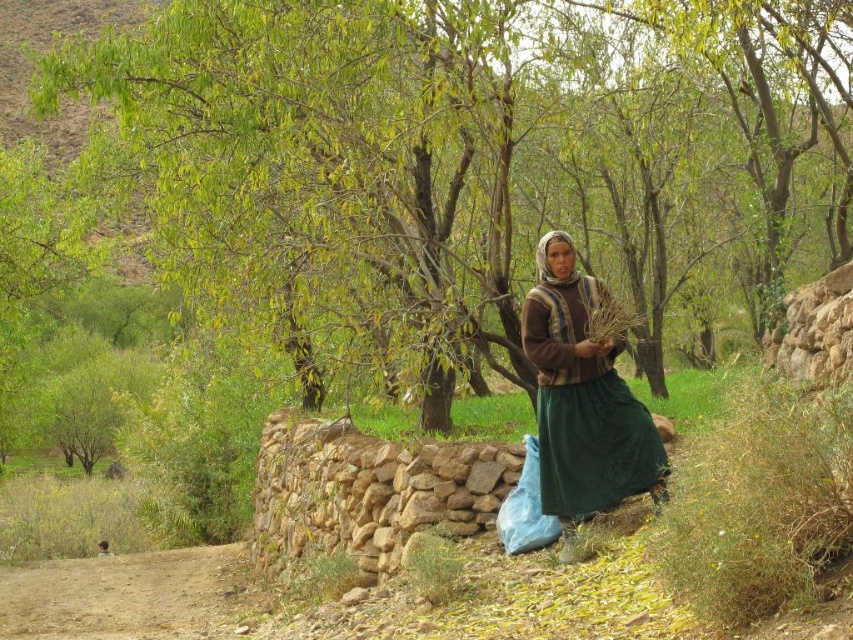
Is point (756, 67) positioned after point (636, 404)?

Yes, it is behind point (636, 404).

Can you confirm if green leafy tree at center is shorter than brown woven scarf at center?

In fact, green leafy tree at center may be taller than brown woven scarf at center.

I want to click on green leafy tree at center, so click(x=474, y=157).